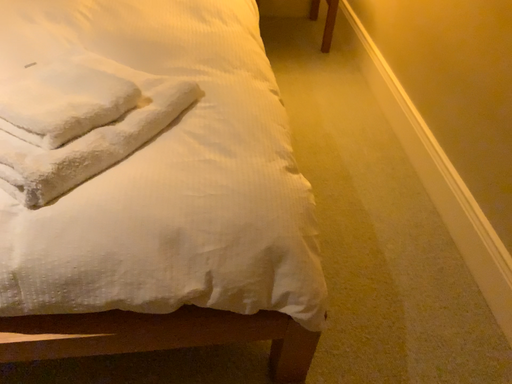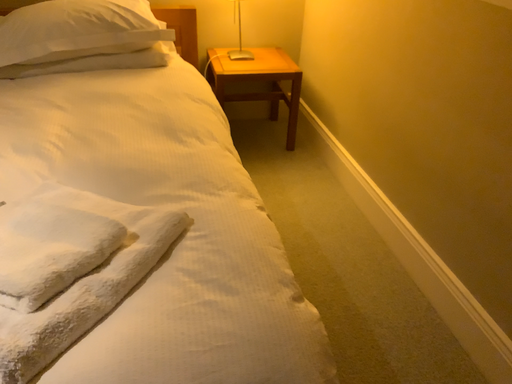
Question: How did the camera likely rotate when shooting the video?

Choices:
 (A) rotated downward
 (B) rotated upward

Answer: (B)